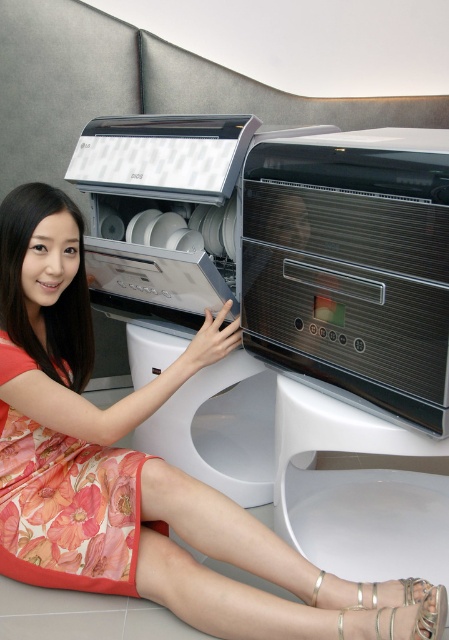
Question: Can you confirm if white glossy dishwasher at center is positioned to the right of floral silk dress at lower left?

Choices:
 (A) no
 (B) yes

Answer: (B)

Question: Which point is farther from the camera taking this photo?

Choices:
 (A) (440, 144)
 (B) (84, 577)
 (C) (108, 520)

Answer: (B)

Question: Where is white glossy dishwasher at center located in relation to pink floral dress at center in the image?

Choices:
 (A) below
 (B) above

Answer: (B)

Question: Among these objects, which one is farthest from the camera?

Choices:
 (A) white glossy dishwasher at center
 (B) floral silk dress at lower left
 (C) pink floral dress at center

Answer: (B)

Question: Based on their relative distances, which object is nearer to the pink floral dress at center?

Choices:
 (A) floral silk dress at lower left
 (B) white glossy dishwasher at center

Answer: (A)

Question: Is pink floral dress at center to the right of floral silk dress at lower left from the viewer's perspective?

Choices:
 (A) yes
 (B) no

Answer: (A)